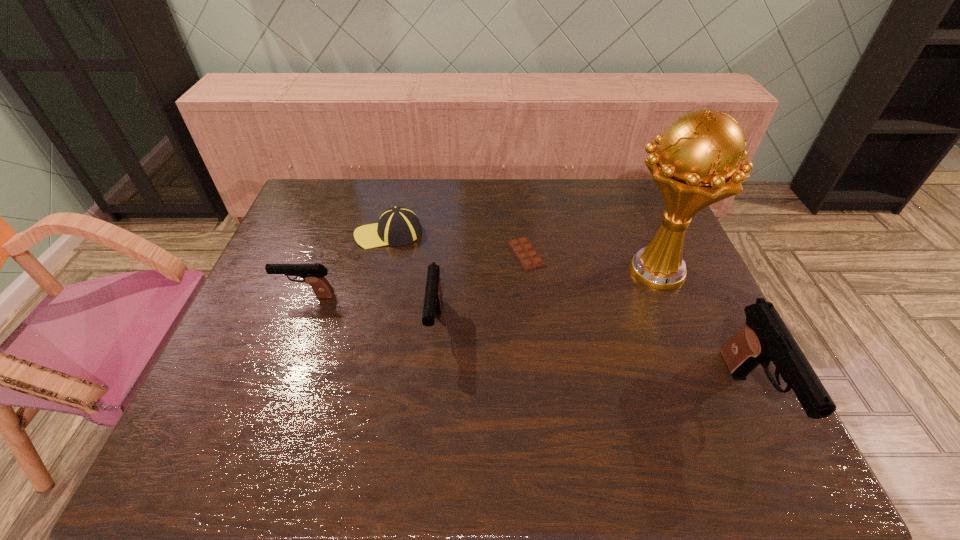
Find the location of `vacant spot for a new pistol to ensure equal spacing`. vacant spot for a new pistol to ensure equal spacing is located at coordinates (581, 360).